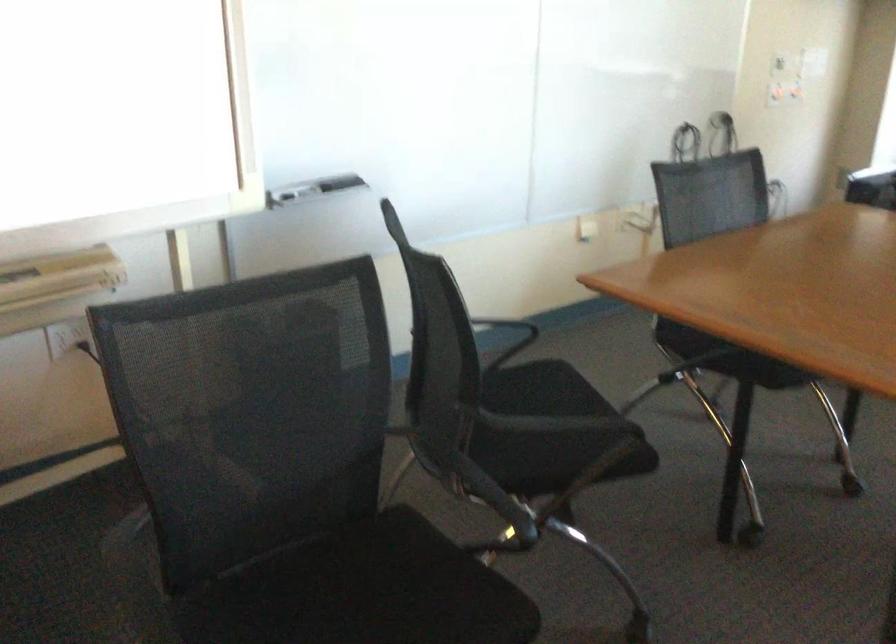
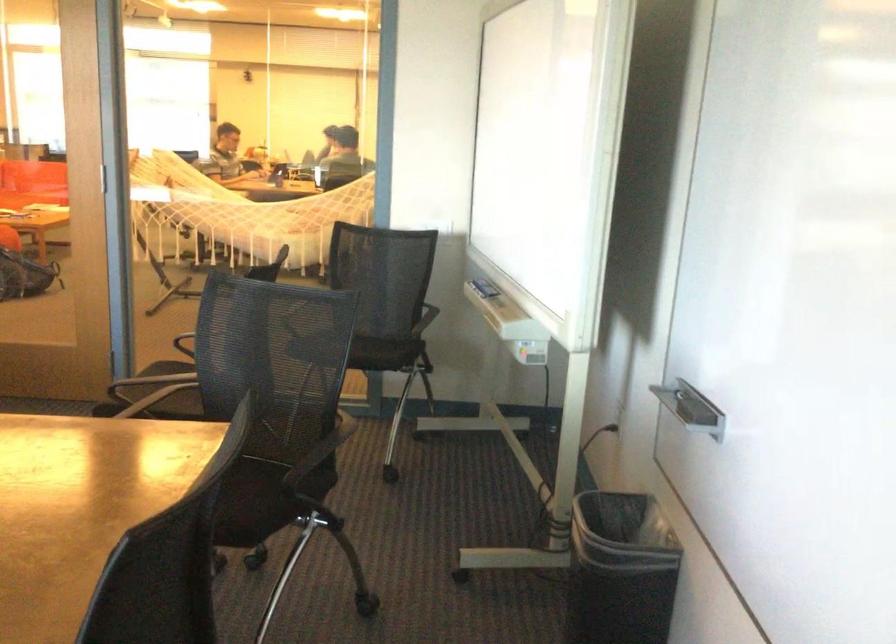
Where in the second image is the point corresponding to pixel 538 398 from the first image?

(243, 494)